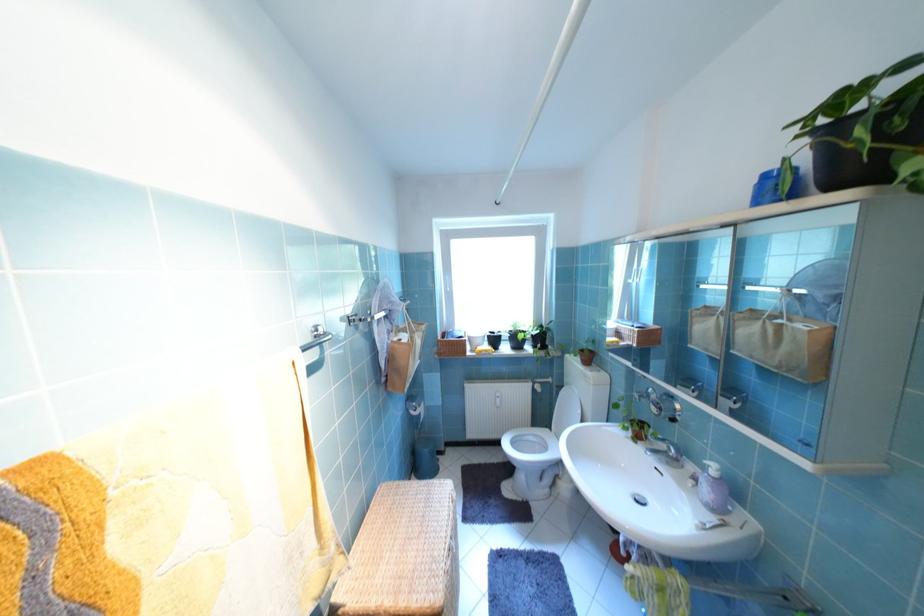
The location [890,160] corresponds to which object?

It corresponds to the large black pot in the image.